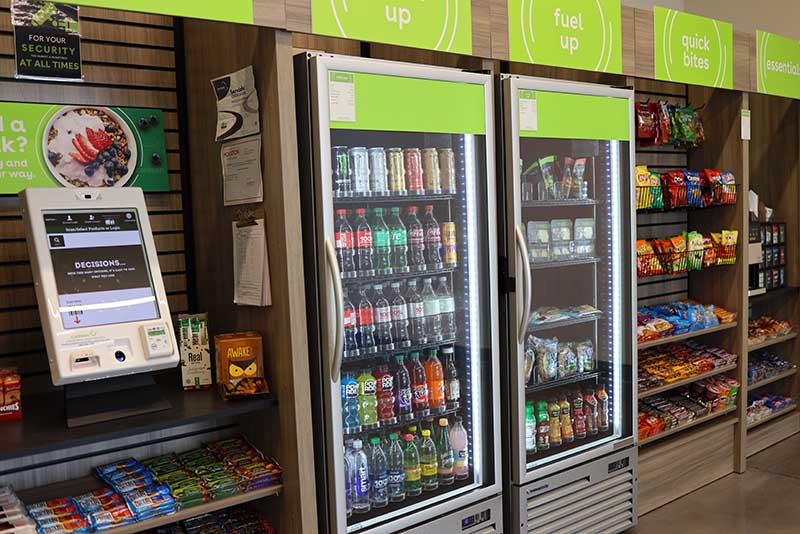
You are a GUI agent. You are given a task and a screenshot of the screen. Output one action in this format:
    pyautogui.click(x=<x>, y=<y>)
    Task: Click on the wall planks
    This screenshot has width=800, height=534.
    Given the screenshot: What is the action you would take?
    pyautogui.click(x=106, y=48), pyautogui.click(x=5, y=279)